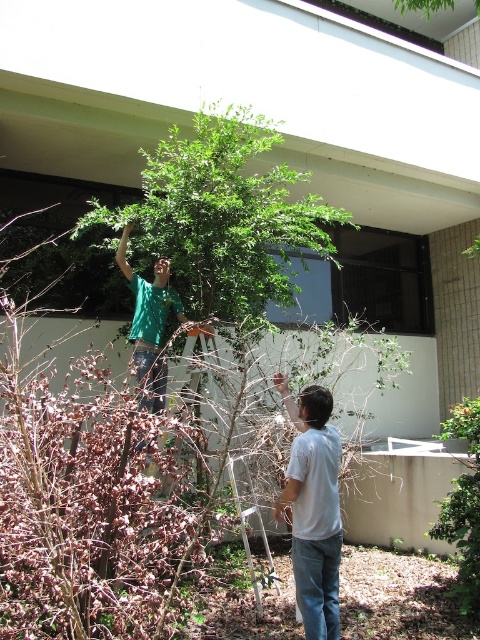
Question: Does white matte shirt at lower right appear over white plastic ladder at center?

Choices:
 (A) yes
 (B) no

Answer: (B)

Question: Which point is closer to the camera?

Choices:
 (A) (338, 516)
 (B) (194, 332)

Answer: (A)

Question: Can you confirm if white matte shirt at lower right is positioned above white plastic ladder at center?

Choices:
 (A) yes
 (B) no

Answer: (B)

Question: Does white matte shirt at lower right have a smaller size compared to white plastic ladder at center?

Choices:
 (A) no
 (B) yes

Answer: (A)

Question: Among these objects, which one is farthest from the camera?

Choices:
 (A) white matte shirt at lower right
 (B) white plastic ladder at center

Answer: (B)